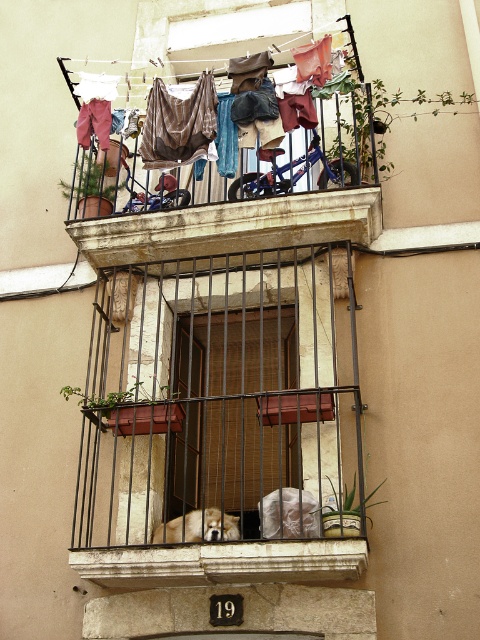
You are standing on the balcony and want to reach the brown fabric pants at upper center. Considering your height is 5 feet 6 inches, can you comfortably reach them without any assistance?

The brown fabric pants at upper center are 103.51 feet away from the viewer, which is far beyond the average person reaching distance. You cannot comfortably reach them without assistance.

You are a painter who needs to hang a 1.2 meter tall canvas on the balcony. Looking at the brown fabric pants at upper center and the wooden blinds at center, which object can you place the canvas next to without blocking the view through the wooden blinds?

The brown fabric pants at upper center is not as tall as wooden blinds at center, so placing the canvas next to the brown fabric pants at upper center would avoid blocking the view through the wooden blinds since it is shorter.

You are a delivery person trying to place a large package on the balcony. The package is as big as the rustic wood balcony at upper center. Is there enough space to place it without moving the fuzzy beige dog at lower center?

The rustic wood balcony at upper center has a larger size compared to the fuzzy beige dog at lower center, so there should be enough space to place the package without moving the dog.